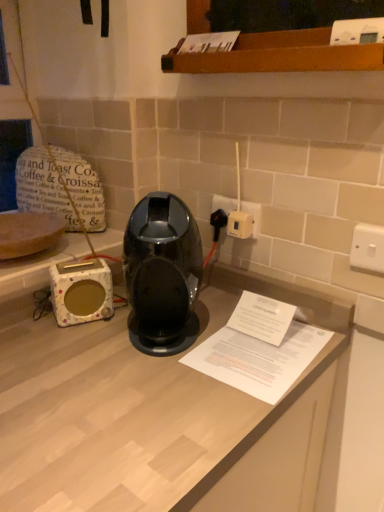
Question: Is white paper at center positioned behind white plastic socket at center-right?

Choices:
 (A) no
 (B) yes

Answer: (A)

Question: Is white paper at center bigger than white plastic socket at center-right?

Choices:
 (A) yes
 (B) no

Answer: (A)

Question: Does white paper at center have a lesser height compared to white plastic socket at center-right?

Choices:
 (A) yes
 (B) no

Answer: (A)

Question: Is white paper at center thinner than white plastic socket at center-right?

Choices:
 (A) no
 (B) yes

Answer: (A)

Question: Is white paper at center not inside white plastic socket at center-right?

Choices:
 (A) yes
 (B) no

Answer: (A)

Question: Would you say white plastic socket at center-right is part of white paper at center's contents?

Choices:
 (A) yes
 (B) no

Answer: (B)

Question: Is white plastic switch at upper right, placed as the first electric outlet when sorted from right to left, to the left of wooden shelf at upper center from the viewer's perspective?

Choices:
 (A) yes
 (B) no

Answer: (B)

Question: From a real-world perspective, is white plastic switch at upper right, the second electric outlet when ordered from back to front, beneath wooden shelf at upper center?

Choices:
 (A) yes
 (B) no

Answer: (A)

Question: Is white plastic switch at upper right, the second electric outlet when ordered from back to front, facing away from wooden shelf at upper center?

Choices:
 (A) yes
 (B) no

Answer: (B)

Question: Can you confirm if white plastic switch at upper right, the 2th electric outlet when ordered from left to right, is shorter than wooden shelf at upper center?

Choices:
 (A) no
 (B) yes

Answer: (B)

Question: Can you confirm if white plastic switch at upper right, the second electric outlet when ordered from back to front, is taller than wooden shelf at upper center?

Choices:
 (A) yes
 (B) no

Answer: (B)

Question: Is the surface of white plastic switch at upper right, the second electric outlet when ordered from back to front, in direct contact with wooden shelf at upper center?

Choices:
 (A) yes
 (B) no

Answer: (B)

Question: Is white ceramic toaster at left in contact with white paper at center?

Choices:
 (A) no
 (B) yes

Answer: (A)